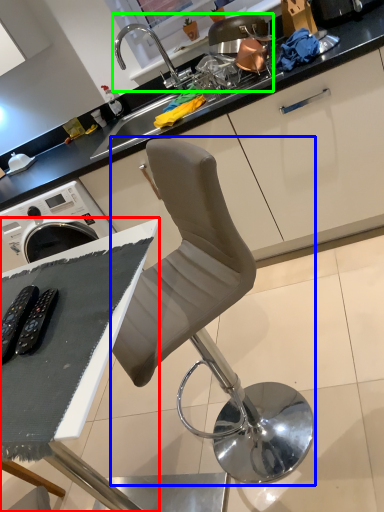
Question: Which is farther away from table (highlighted by a red box)? chair (highlighted by a blue box) or sink (highlighted by a green box)?

Choices:
 (A) chair
 (B) sink

Answer: (B)